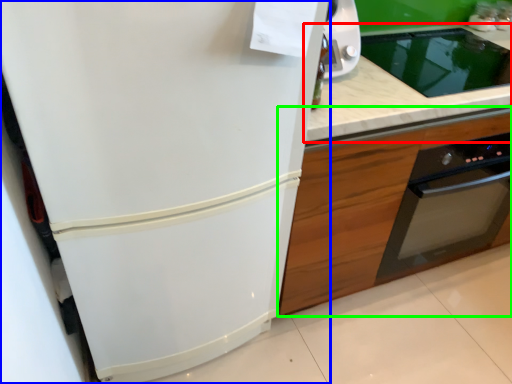
Question: Which object is the closest to the countertop (highlighted by a red box)? Choose among these: refrigerator (highlighted by a blue box) or cabinetry (highlighted by a green box).

Choices:
 (A) refrigerator
 (B) cabinetry

Answer: (B)